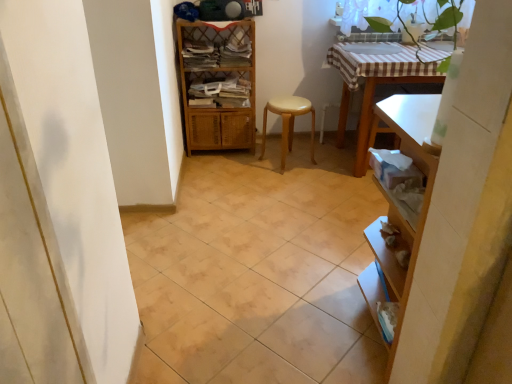
The width and height of the screenshot is (512, 384). I want to click on vacant space in front of woven wood shelf at center, so click(214, 171).